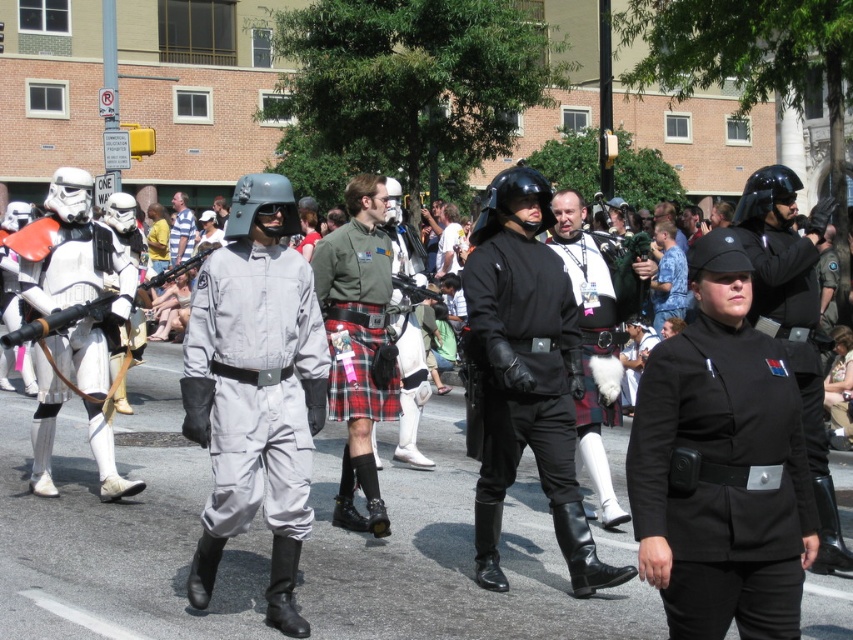
Can you confirm if white matte stormtrooper armor at left is bigger than black matte helmet at center?

Yes, white matte stormtrooper armor at left is bigger than black matte helmet at center.

Between point (47, 496) and point (839, 525), which one is positioned behind?

The point (47, 496) is behind.

Does point (36, 288) come farther from viewer compared to point (788, 356)?

That is True.

This screenshot has width=853, height=640. I want to click on white matte stormtrooper armor at left, so click(x=71, y=252).

Who is more forward, (801,497) or (621,579)?

Point (801,497) is more forward.

Which is behind, point (697, 477) or point (541, 186)?

The point (541, 186) is more distant.

Find the location of a particular element. black matte uniform at center is located at coordinates (721, 483).

Is point (57, 410) behind point (563, 218)?

Yes.

Which is in front, point (91, 256) or point (598, 484)?

Point (598, 484)

Does point (77, 266) lie in front of point (587, 428)?

No, (77, 266) is behind (587, 428).

Find the location of a particular element. This screenshot has height=640, width=853. white matte stormtrooper armor at left is located at coordinates (71, 252).